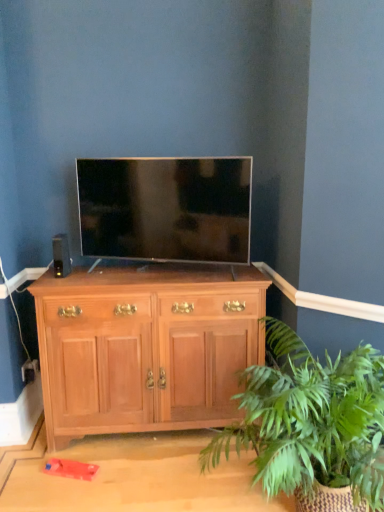
Question: Is black matte speaker at left not near light brown wood cabinet at center?

Choices:
 (A) yes
 (B) no

Answer: (B)

Question: Is black matte speaker at left next to light brown wood cabinet at center?

Choices:
 (A) yes
 (B) no

Answer: (B)

Question: Is black matte speaker at left surrounding light brown wood cabinet at center?

Choices:
 (A) no
 (B) yes

Answer: (A)

Question: Does black matte speaker at left come in front of light brown wood cabinet at center?

Choices:
 (A) yes
 (B) no

Answer: (B)

Question: Is black matte speaker at left taller than light brown wood cabinet at center?

Choices:
 (A) yes
 (B) no

Answer: (B)

Question: Can you confirm if black matte speaker at left is positioned to the left of light brown wood cabinet at center?

Choices:
 (A) yes
 (B) no

Answer: (A)

Question: Considering the relative positions of black matte speaker at left and green leafy plant at lower right in the image provided, is black matte speaker at left to the left of green leafy plant at lower right from the viewer's perspective?

Choices:
 (A) yes
 (B) no

Answer: (A)

Question: From a real-world perspective, is black matte speaker at left positioned over green leafy plant at lower right based on gravity?

Choices:
 (A) no
 (B) yes

Answer: (B)

Question: From a real-world perspective, is black matte speaker at left under green leafy plant at lower right?

Choices:
 (A) no
 (B) yes

Answer: (A)

Question: Are black matte speaker at left and green leafy plant at lower right making contact?

Choices:
 (A) yes
 (B) no

Answer: (B)

Question: Does black matte speaker at left have a lesser width compared to green leafy plant at lower right?

Choices:
 (A) yes
 (B) no

Answer: (A)

Question: Does black matte speaker at left lie in front of green leafy plant at lower right?

Choices:
 (A) no
 (B) yes

Answer: (A)

Question: Does black matte speaker at left have a larger size compared to matte black tv at center?

Choices:
 (A) no
 (B) yes

Answer: (A)